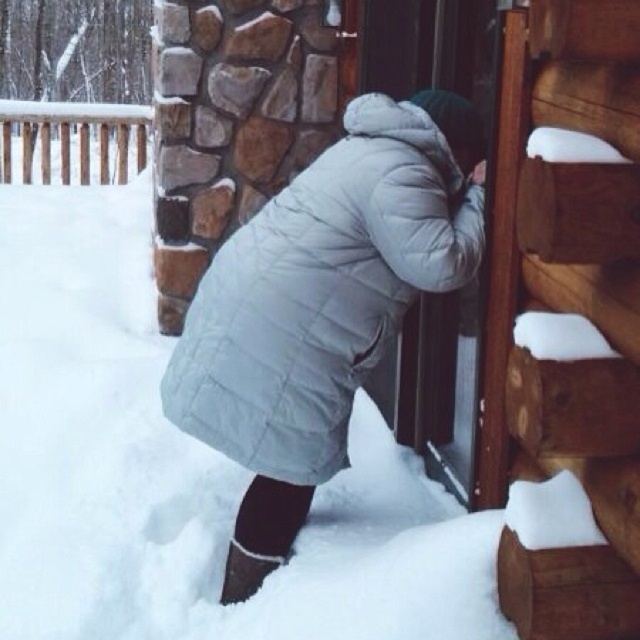
You are standing at the point marked as point [321,292]. You want to move towards the wooden door of the cabin. Is the wooden door of the cabin located to your left or right side?

The white quilted jacket at center is located at point [321,292]. Since the wooden door is part of the cabin structure described in the scene, and the person is interacting with the door, it can be inferred that the door is in front of the jacket, not to the left or right.

You are standing at the entrance of the cabin and see the white quilted jacket at center and the white wooden railing at upper left. Which object is nearer to you?

The white quilted jacket at center is closer to the viewer than the white wooden railing at upper left.

You are standing at the origin point of the image. Where is the white quilted jacket at center located in terms of coordinates?

The white quilted jacket at center is located at coordinates point [321,292].